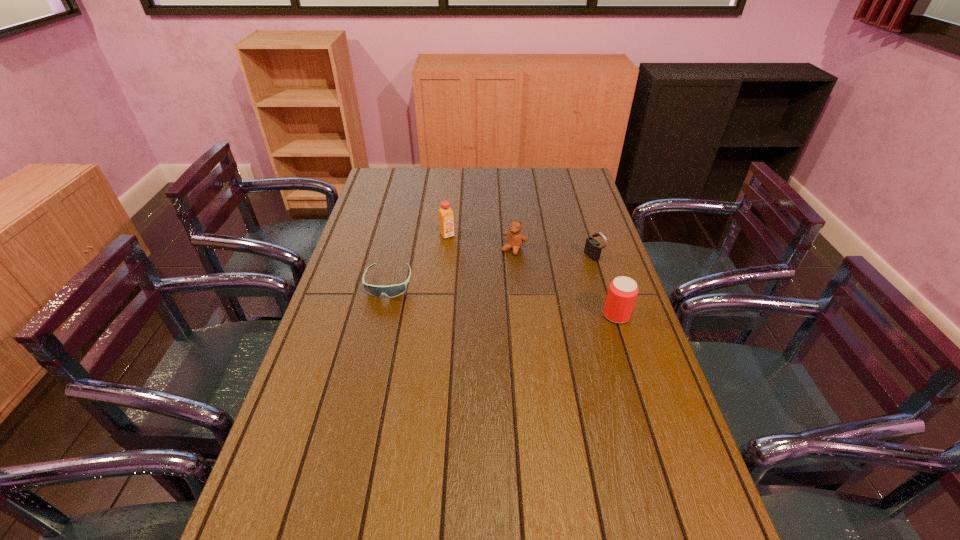
The image size is (960, 540). What are the coordinates of `vacant space on the desktop that is between the goggles and the nearest object and is positioned with the keyhole on the front of the padlock` in the screenshot? It's located at (478, 295).

Identify the location of free spot on the desktop that is between the leftmost object and the nearest object and is positioned on the face of the third object from right to left. (479, 296).

This screenshot has height=540, width=960. I want to click on vacant space on the desktop that is between the goggles and the beer can and is positioned on the front and back of the orange juice, so click(502, 299).